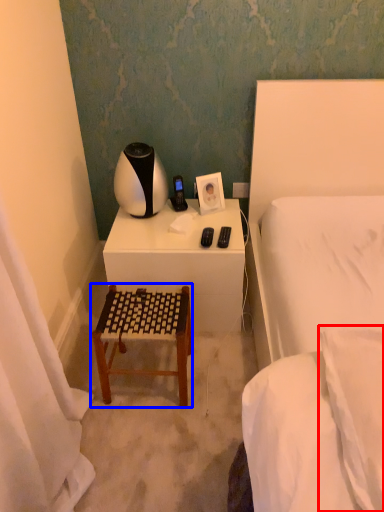
Question: Which object appears closest to the camera in this image, pillow (highlighted by a red box) or furniture (highlighted by a blue box)?

Choices:
 (A) pillow
 (B) furniture

Answer: (A)